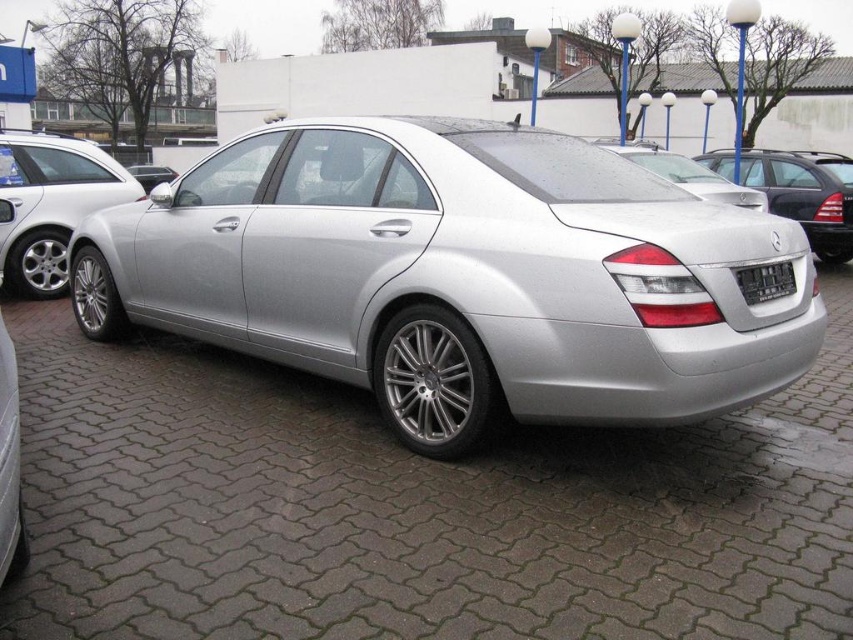
Question: Considering the real-world distances, which object is closest to the silver metallic car at center?

Choices:
 (A) satin silver car at center
 (B) silver metallic sedan at left
 (C) black plastic license plate at rear

Answer: (C)

Question: Observing the image, what is the correct spatial positioning of silver metallic sedan at left in reference to satin silver car at center?

Choices:
 (A) below
 (B) above

Answer: (A)

Question: Considering the relative positions of satin silver car at center and black plastic license plate at rear in the image provided, where is satin silver car at center located with respect to black plastic license plate at rear?

Choices:
 (A) below
 (B) above

Answer: (B)

Question: Which object is closer to the camera taking this photo?

Choices:
 (A) black plastic license plate at rear
 (B) silver metallic sedan at left

Answer: (A)

Question: Is silver metallic car at center positioned behind satin silver car at center?

Choices:
 (A) yes
 (B) no

Answer: (B)

Question: Which of these objects is positioned closest to the black plastic license plate at rear?

Choices:
 (A) silver metallic car at center
 (B) silver metallic sedan at left
 (C) satin silver car at center

Answer: (A)